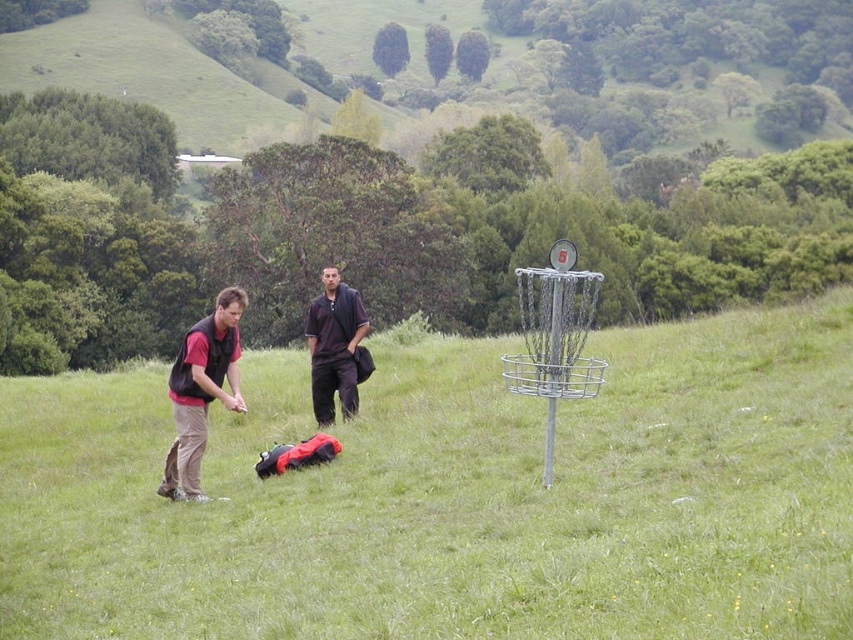
Question: Which object is closer to the camera taking this photo?

Choices:
 (A) brushed metal vest at left
 (B) dark matte shirt at center
 (C) green grassy field at center

Answer: (C)

Question: Which point is farther to the camera?

Choices:
 (A) (231, 314)
 (B) (171, 406)

Answer: (B)

Question: Is matte black vest at left positioned at the back of brushed metal vest at left?

Choices:
 (A) yes
 (B) no

Answer: (B)

Question: Which of the following is the closest to the observer?

Choices:
 (A) (187, 381)
 (B) (352, 330)
 (C) (224, 404)

Answer: (C)

Question: Can you confirm if green grassy field at center is smaller than matte black vest at left?

Choices:
 (A) yes
 (B) no

Answer: (B)

Question: Does matte black vest at left have a smaller size compared to dark matte shirt at center?

Choices:
 (A) yes
 (B) no

Answer: (B)